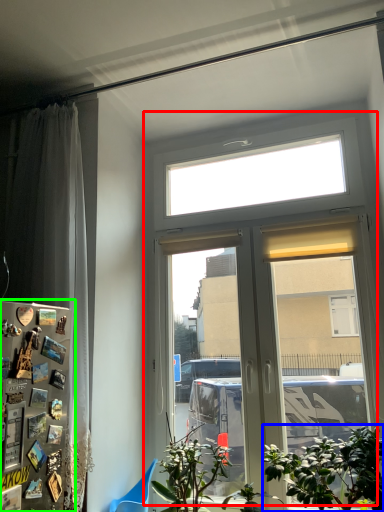
Question: Estimate the real-world distances between objects in this image. Which object is closer to window (highlighted by a red box), houseplant (highlighted by a blue box) or fridge (highlighted by a green box)?

Choices:
 (A) houseplant
 (B) fridge

Answer: (A)